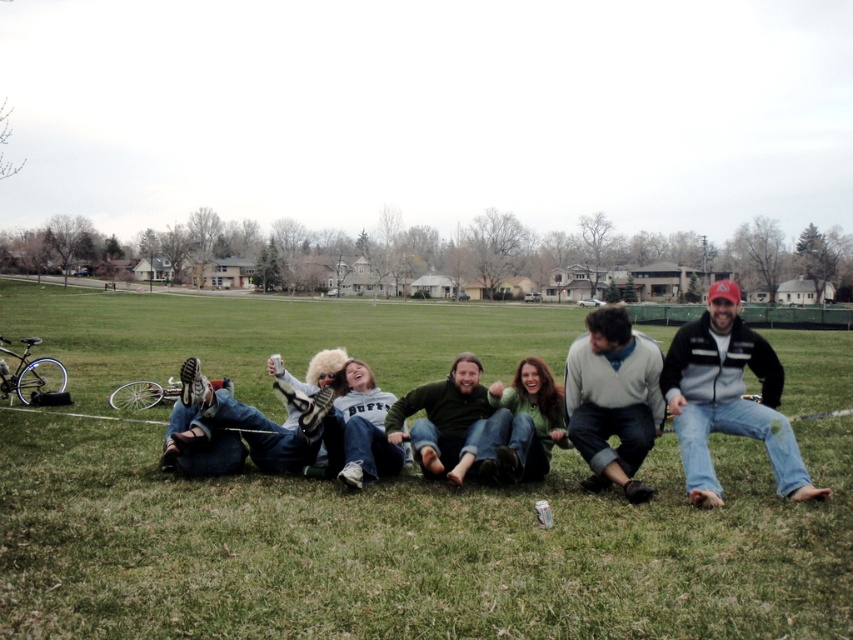
You are organizing a charity event and need to decide which item to donate between the white fuzzy hat at center and the green sweater at center based on their sizes. Which item would you choose if you prefer donating larger items?

The white fuzzy hat at center has a larger size compared to the green sweater at center, so you should choose the white fuzzy hat at center for donation.

You are a photographer trying to capture a clear shot of the green sweater at center and the green fuzzy sweater at center. Since both are in the same area, which one would you focus on to ensure the other remains visible in the background?

You should focus on the green sweater at center because it is in front of the green fuzzy sweater at center, so the latter will naturally appear in the background.

You are a photographer trying to capture a photo of the group. You notice the white fuzzy hat at center and the green sweater at center. Which one is positioned higher in the image?

The white fuzzy hat at center is located above the green sweater at center, so it is positioned higher in the image.